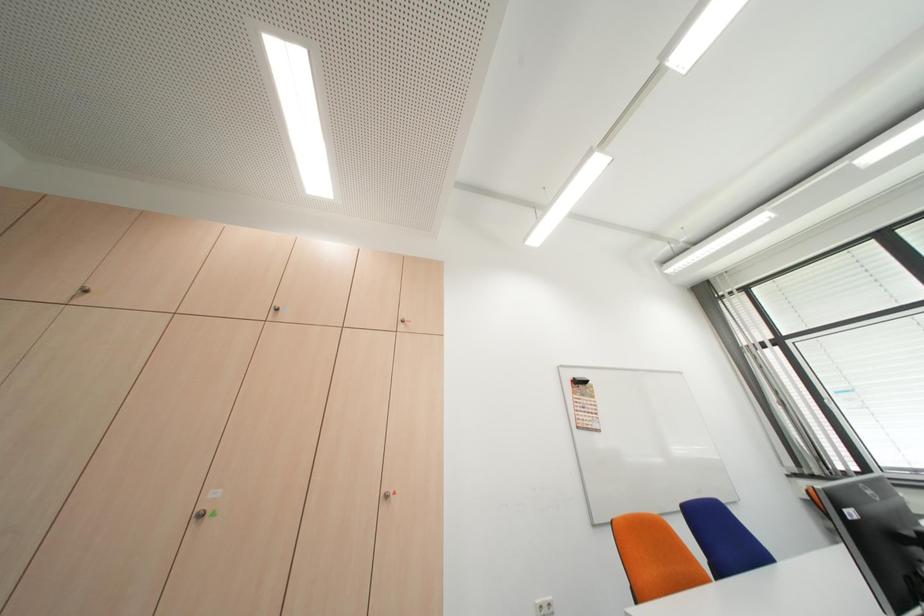
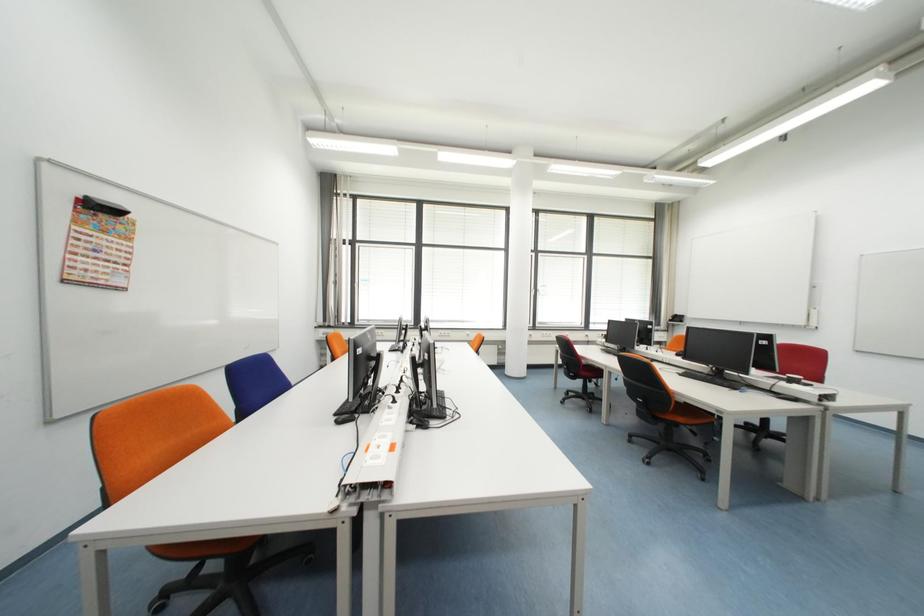
Question: The first image is from the beginning of the video and the second image is from the end. How did the camera likely rotate when shooting the video?

Choices:
 (A) Left
 (B) Right
 (C) Up
 (D) Down

Answer: (B)